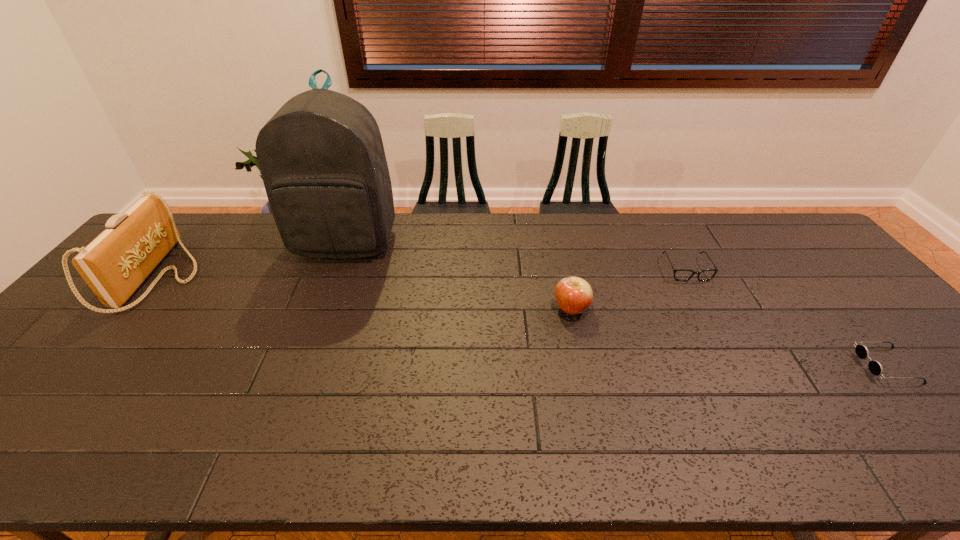
At what (x,y) coordinates should I click in order to perform the action: click on vacant area situated on the decorative side of the handbag. Please return your answer as a coordinate pair (x, y). Looking at the image, I should click on (255, 277).

I want to click on vacant space located on the right of the third tallest object, so click(724, 309).

Find the location of a particular element. blank space located on the front-facing side of the second object from right to left is located at coordinates (723, 336).

This screenshot has width=960, height=540. I want to click on free spot located on the front-facing side of the rightmost object, so click(735, 366).

At what (x,y) coordinates should I click in order to perform the action: click on vacant space situated on the front-facing side of the rightmost object. Please return your answer as a coordinate pair (x, y). Looking at the image, I should click on click(x=715, y=366).

You are a GUI agent. You are given a task and a screenshot of the screen. Output one action in this format:
    pyautogui.click(x=<x>, y=<y>)
    Task: Click on the free space located 0.060m on the front-facing side of the rightmost object
    The height and width of the screenshot is (540, 960).
    Given the screenshot: What is the action you would take?
    pyautogui.click(x=838, y=366)

Locate an element on the screen. backpack that is at the far edge is located at coordinates (321, 156).

The image size is (960, 540). Find the location of `handbag located in the far edge section of the desktop`. handbag located in the far edge section of the desktop is located at coordinates (114, 265).

Find the location of a particular element. The image size is (960, 540). object located at the left edge is located at coordinates 114,265.

Where is `object that is positioned at the right edge`? This screenshot has height=540, width=960. object that is positioned at the right edge is located at coordinates (862, 352).